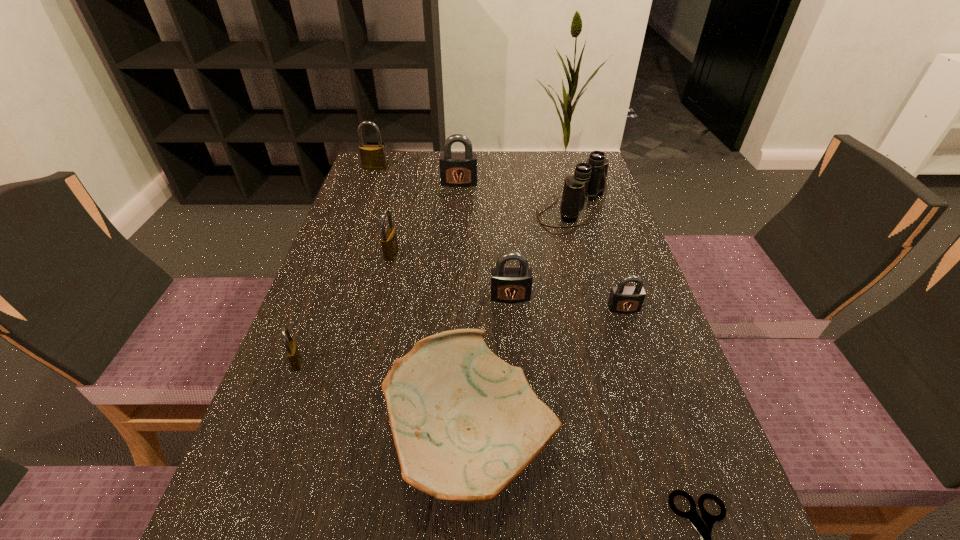
This screenshot has height=540, width=960. Identify the location of empty space that is in between the nearest brass padlock and the farthest brass padlock. (336, 265).

This screenshot has height=540, width=960. Find the location of `the fifth closest object to the second smallest gray padlock`. the fifth closest object to the second smallest gray padlock is located at coordinates (292, 351).

This screenshot has width=960, height=540. What are the coordinates of `object that is the fourth closest to the shortest object` in the screenshot? It's located at (x=589, y=180).

I want to click on the fourth closest padlock to the second gray padlock from left to right, so click(456, 169).

I want to click on the second closest padlock to the rightmost padlock, so click(389, 242).

I want to click on brass padlock that is the third closest to the leftmost gray padlock, so coord(292,351).

Find the location of a particular element. The height and width of the screenshot is (540, 960). brass padlock that is the second nearest to the second farthest brass padlock is located at coordinates (372, 156).

Identify which gray padlock is located as the second nearest to the second padlock from right to left. Please provide its 2D coordinates. Your answer should be formatted as a tuple, i.e. [(x, y)], where the tuple contains the x and y coordinates of a point satisfying the conditions above.

[(456, 169)]

Locate which gray padlock ranks second in proximity to the farthest padlock. Please provide its 2D coordinates. Your answer should be formatted as a tuple, i.e. [(x, y)], where the tuple contains the x and y coordinates of a point satisfying the conditions above.

[(510, 284)]